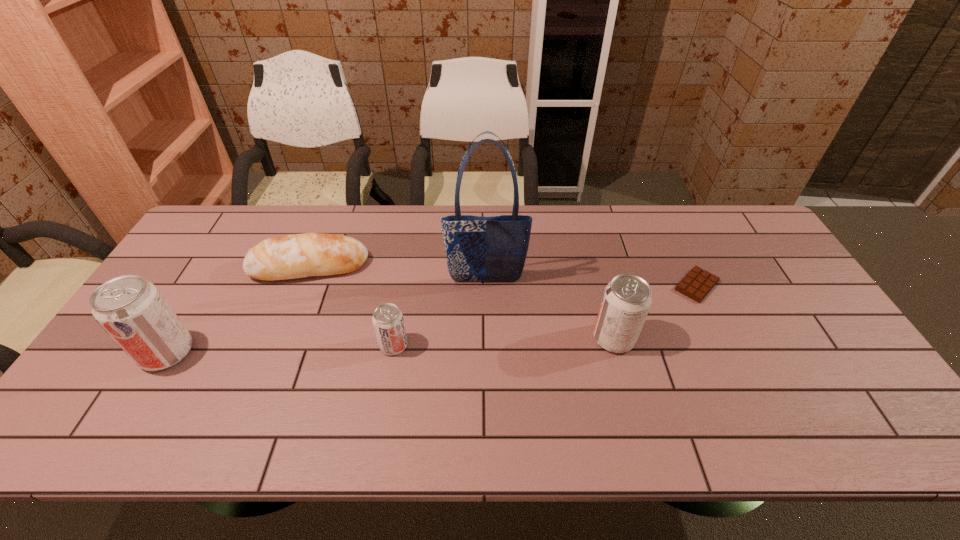
With all soda cans evenly spaced, where should an extra soda can be placed on the right to continue the pattern? Please point out a vacant space. Please provide its 2D coordinates. Your answer should be formatted as a tuple, i.e. [(x, y)], where the tuple contains the x and y coordinates of a point satisfying the conditions above.

[(828, 332)]